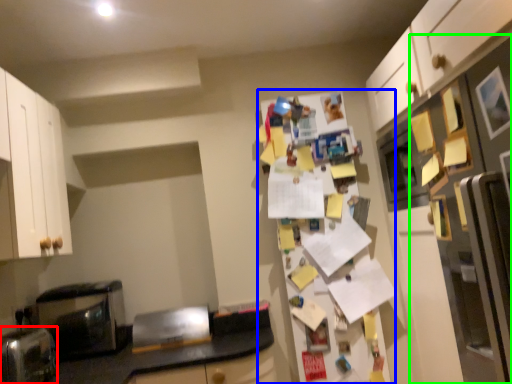
Question: Considering the real-world distances, which object is farthest from appliance (highlighted by a red box)? fridge (highlighted by a blue box) or fridge (highlighted by a green box)?

Choices:
 (A) fridge
 (B) fridge

Answer: (B)